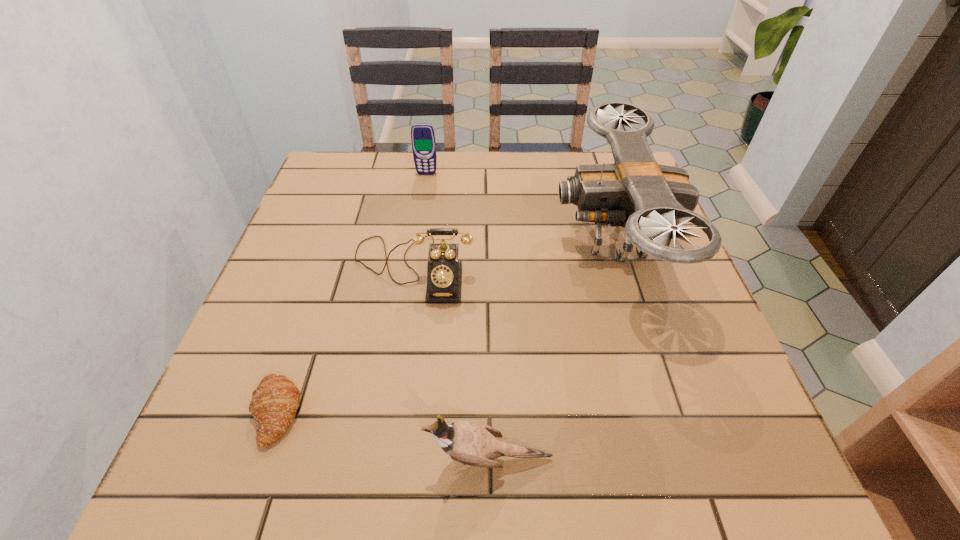
Find the location of `the rightmost object`. the rightmost object is located at coordinates (650, 200).

What are the coordinates of `the tallest object` in the screenshot? It's located at (650, 200).

Where is `cellular telephone`? cellular telephone is located at coordinates (423, 141).

Where is `bird`? Image resolution: width=960 pixels, height=540 pixels. bird is located at coordinates (475, 444).

Find the location of a particular element. This screenshot has width=960, height=540. telephone is located at coordinates (444, 272).

Where is `crescent roll`? The height and width of the screenshot is (540, 960). crescent roll is located at coordinates (273, 406).

The image size is (960, 540). In order to click on the leftmost object in this screenshot , I will do `click(273, 406)`.

The image size is (960, 540). Identify the location of vacant space located on the front-facing side of the tallest object. (429, 238).

Where is `vacant space positioned 0.300m on the front-facing side of the tallest object`? Image resolution: width=960 pixels, height=540 pixels. vacant space positioned 0.300m on the front-facing side of the tallest object is located at coordinates click(429, 238).

Find the location of a particular element. This screenshot has height=540, width=960. vacant space situated on the front-facing side of the tallest object is located at coordinates (454, 238).